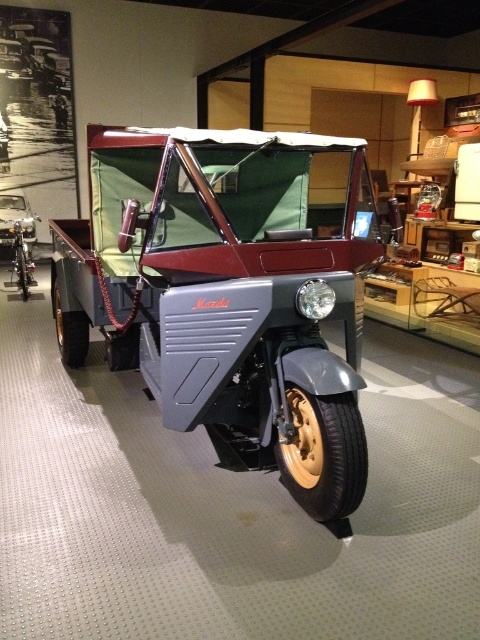
You are a museum curator planning to move the metallic gray jeep at center and the shiny silver car at left into a new exhibit. The entrance to the new exhibit has a 2.5 meter wide doorway. Can both vehicles fit through the doorway side by side without overlapping?

The metallic gray jeep at center is wider than the shiny silver car at left. Since the doorway is only 2.5 meters wide, it is uncertain if both can fit side by side without overlapping without knowing their exact widths. However, since the jeep is wider, it might take up more space, making it potentially difficult for both to fit together.

You are standing in front of two vehicles in a museum. You see a metallic gray jeep at center and a shiny silver car at left. Which vehicle is positioned to the right of the other?

The metallic gray jeep at center is positioned to the right of the shiny silver car at left.

You are a security guard in a car museum and need to determine which vehicle is taller between the metallic gray jeep at center and the shiny silver car at left. Based on the scene, which one is taller?

The metallic gray jeep at center is much taller than the shiny silver car at left.